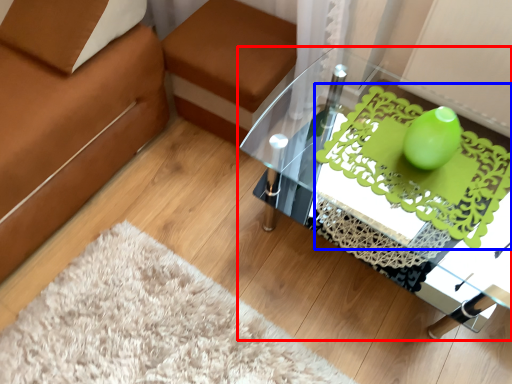
Question: Which point is closer to the camera, table (highlighted by a red box) or design (highlighted by a blue box)?

Choices:
 (A) table
 (B) design

Answer: (A)